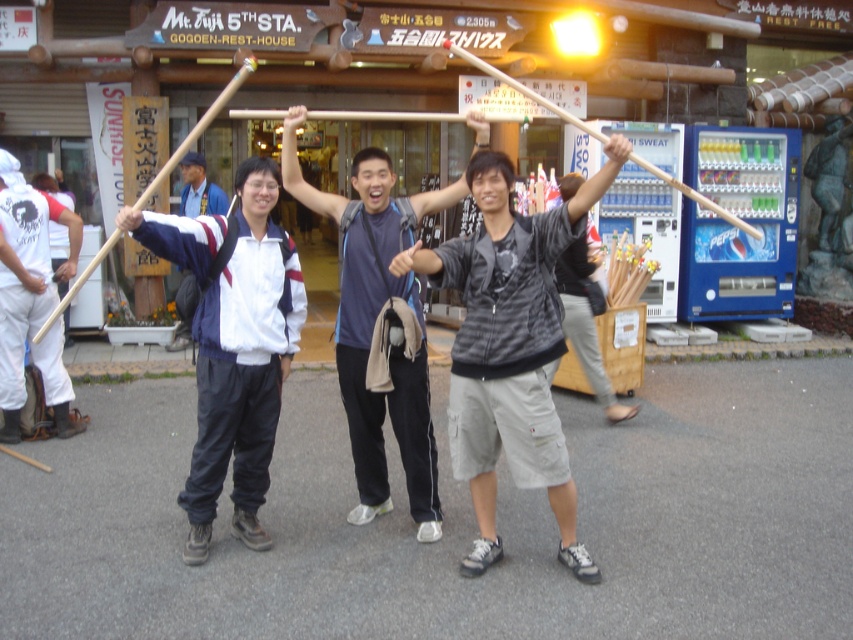
Is point (276, 340) more distant than point (187, 324)?

No, it is not.

Between point (294, 333) and point (192, 184), which one is positioned in front?

Point (294, 333) is more forward.

At what (x,y) coordinates should I click in order to perform the action: click on white matte jacket at center. Please return your answer as a coordinate pair (x, y). The height and width of the screenshot is (640, 853). Looking at the image, I should click on (233, 344).

Does point (498, 202) lie behind point (187, 257)?

That is False.

Is gray cotton shorts at center shorter than white matte jacket at center?

No, gray cotton shorts at center is not shorter than white matte jacket at center.

Which is in front, point (465, 404) or point (265, 330)?

Positioned in front is point (465, 404).

Locate an element on the screen. gray cotton shorts at center is located at coordinates (509, 348).

Who is positioned more to the right, white cotton pants at left or white jacket at center?

white jacket at center

Which is behind, point (64, 211) or point (222, 193)?

Point (222, 193)

Where is `white cotton pants at left`? This screenshot has height=640, width=853. white cotton pants at left is located at coordinates (25, 278).